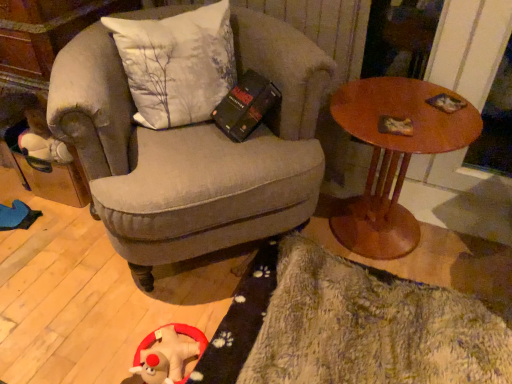
Question: From the image's perspective, is fluffy beige rug at lower right over white fabric pillow at upper left?

Choices:
 (A) no
 (B) yes

Answer: (A)

Question: Considering the relative sizes of fluffy beige rug at lower right and white fabric pillow at upper left in the image provided, is fluffy beige rug at lower right wider than white fabric pillow at upper left?

Choices:
 (A) no
 (B) yes

Answer: (B)

Question: Is there a large distance between fluffy beige rug at lower right and white fabric pillow at upper left?

Choices:
 (A) yes
 (B) no

Answer: (B)

Question: From the image's perspective, is fluffy beige rug at lower right beneath white fabric pillow at upper left?

Choices:
 (A) no
 (B) yes

Answer: (B)

Question: Are fluffy beige rug at lower right and white fabric pillow at upper left making contact?

Choices:
 (A) no
 (B) yes

Answer: (A)

Question: Is fluffy beige rug at lower right to the right of white fabric pillow at upper left from the viewer's perspective?

Choices:
 (A) no
 (B) yes

Answer: (B)

Question: Is white fabric pillow at upper left wider than textured gray armchair at center?

Choices:
 (A) yes
 (B) no

Answer: (B)

Question: Is white fabric pillow at upper left looking in the opposite direction of textured gray armchair at center?

Choices:
 (A) yes
 (B) no

Answer: (A)

Question: From a real-world perspective, is white fabric pillow at upper left positioned over textured gray armchair at center based on gravity?

Choices:
 (A) yes
 (B) no

Answer: (A)

Question: From the image's perspective, is white fabric pillow at upper left under textured gray armchair at center?

Choices:
 (A) yes
 (B) no

Answer: (B)

Question: From a real-world perspective, does white fabric pillow at upper left sit lower than textured gray armchair at center?

Choices:
 (A) yes
 (B) no

Answer: (B)

Question: Would you say white fabric pillow at upper left is outside textured gray armchair at center?

Choices:
 (A) no
 (B) yes

Answer: (A)

Question: From the image's perspective, would you say fuzzy plush toy at lower left is shown under wooden round table at right?

Choices:
 (A) yes
 (B) no

Answer: (A)